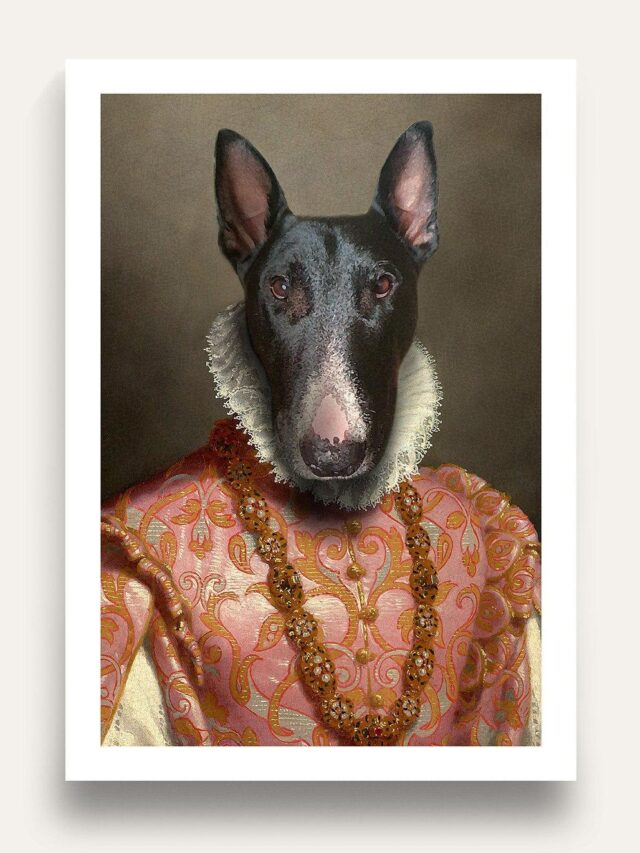
Image resolution: width=640 pixels, height=853 pixels. I want to click on poloroid photo, so click(x=333, y=762), click(x=89, y=438), click(x=560, y=427), click(x=329, y=70).